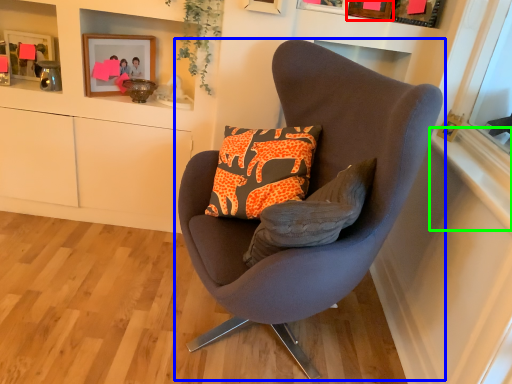
Question: Estimate the real-world distances between objects in this image. Which object is closer to picture frame (highlighted by a red box), chair (highlighted by a blue box) or window sill (highlighted by a green box)?

Choices:
 (A) chair
 (B) window sill

Answer: (B)